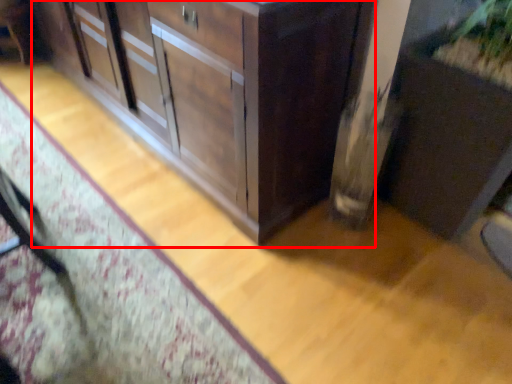
Question: From the image's perspective, where is cabinetry (annotated by the red box) located in relation to cabinetry in the image?

Choices:
 (A) above
 (B) below

Answer: (A)